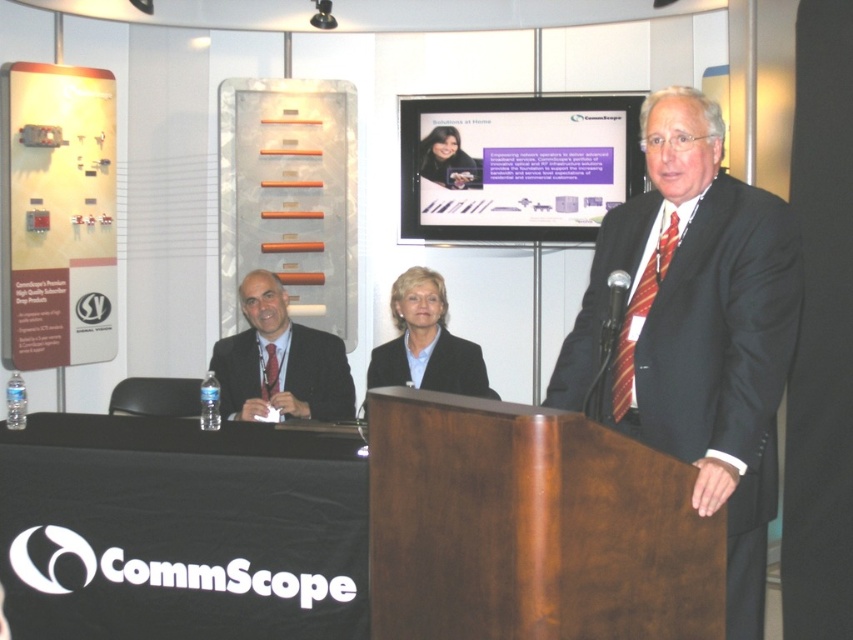
You are an event organizer trying to arrange seating for a panel discussion. You have two participants wearing the dark suit at center and the black fabric business suit at center. If you need to seat them in chairs of the same size, which participant might need a larger chair?

The dark suit at center is bigger than the black fabric business suit at center, so the participant wearing the dark suit at center would require a larger chair.

You are an event organizer setting up chairs for an audience. You need to place two chairs in front of the podium for speakers. The dark suit at center and the black fabric business suit at center are the speakers. Which speaker should you place the taller chair for?

The dark suit at center is much taller than the black fabric business suit at center, so you should place the taller chair for the dark suit at center.